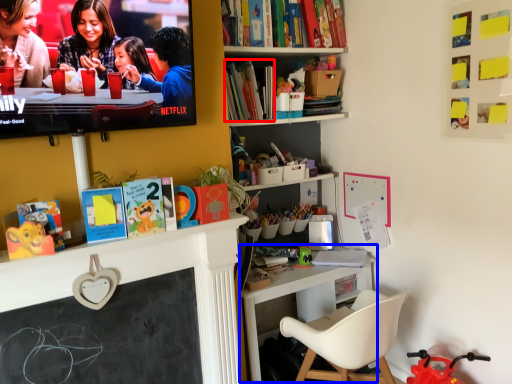
Question: Which point is closer to the camera, book (highlighted by a red box) or table (highlighted by a blue box)?

Choices:
 (A) book
 (B) table

Answer: (B)